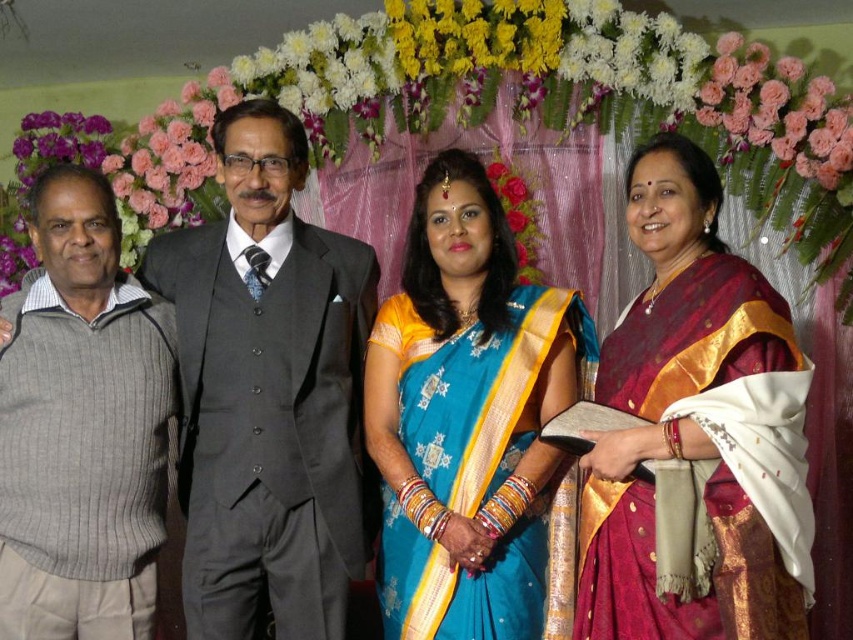
Question: Observing the image, what is the correct spatial positioning of dark gray suit at center in reference to blue silk saree at center?

Choices:
 (A) right
 (B) left

Answer: (B)

Question: Which of the following is the farthest from the observer?

Choices:
 (A) (39, 241)
 (B) (494, 550)

Answer: (A)

Question: Does blue silk saree at center appear over maroon silk saree at center?

Choices:
 (A) yes
 (B) no

Answer: (B)

Question: Can you confirm if dark gray suit at center is wider than gray ribbed sweater at left?

Choices:
 (A) yes
 (B) no

Answer: (A)

Question: Which object is farther from the camera taking this photo?

Choices:
 (A) dark gray suit at center
 (B) maroon silk saree at center
 (C) gray ribbed sweater at left
 (D) blue silk saree at center

Answer: (A)

Question: Which object is positioned farthest from the gray ribbed sweater at left?

Choices:
 (A) maroon silk saree at center
 (B) dark gray suit at center
 (C) blue silk saree at center

Answer: (A)